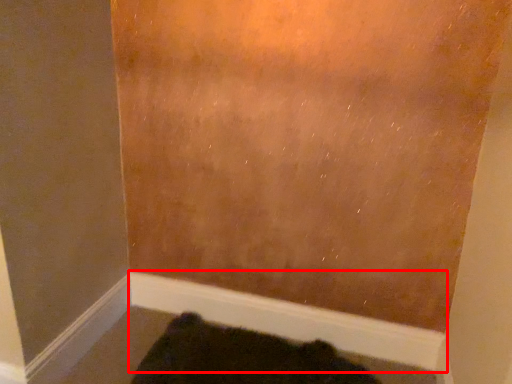
Question: From the image's perspective, considering the relative positions of molding (annotated by the red box) and animal in the image provided, where is molding (annotated by the red box) located with respect to the staircase?

Choices:
 (A) below
 (B) above

Answer: (B)